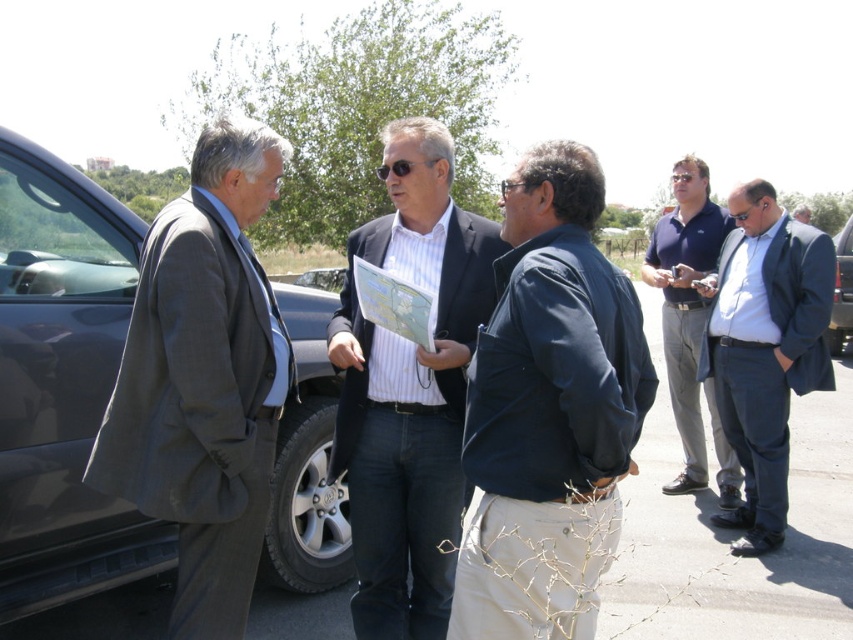
Question: Can you confirm if gray wool suit at left is positioned to the left of dark blue suit at right?

Choices:
 (A) yes
 (B) no

Answer: (A)

Question: Among these points, which one is nearest to the camera?

Choices:
 (A) (553, 188)
 (B) (782, 381)

Answer: (A)

Question: Can you confirm if dark blue jacket at center is positioned to the left of metallic silver car at right?

Choices:
 (A) no
 (B) yes

Answer: (B)

Question: Which point is farther to the camera?

Choices:
 (A) light blue shirt at upper right
 (B) dark blue suit at right

Answer: (A)

Question: Based on their relative distances, which object is nearer to the metallic silver car at right?

Choices:
 (A) gray wool suit at left
 (B) dark blue polo shirt at right

Answer: (B)

Question: Can you confirm if dark blue polo shirt at right is bigger than light blue shirt at upper right?

Choices:
 (A) no
 (B) yes

Answer: (A)